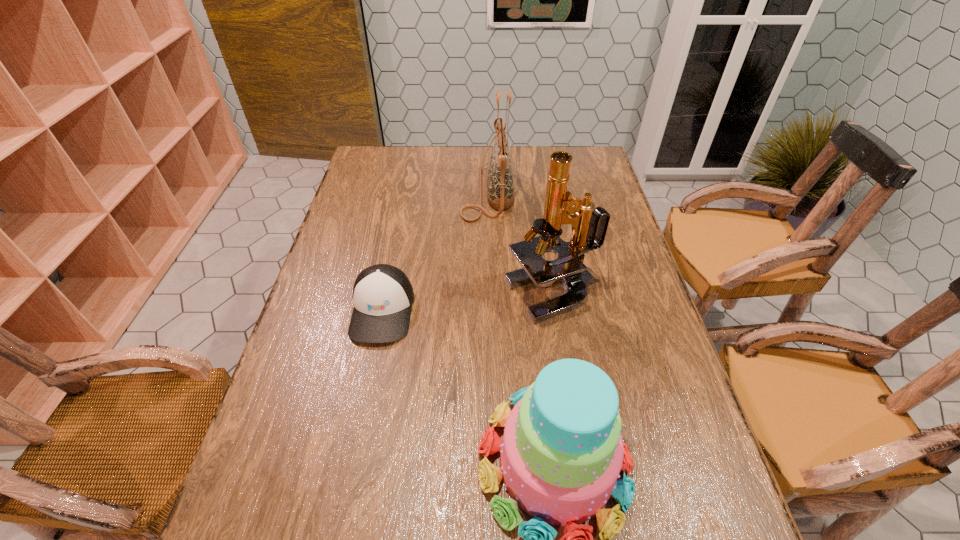
Identify the location of unoccupied area between the microscope and the leftmost object. (468, 302).

Identify the location of free space between the leftmost object and the tallest object. This screenshot has width=960, height=540. (468, 302).

Locate an element on the screen. Image resolution: width=960 pixels, height=540 pixels. empty space between the tallest object and the leftmost object is located at coordinates (468, 302).

This screenshot has height=540, width=960. Find the location of `the second closest object to the tallest object`. the second closest object to the tallest object is located at coordinates (500, 194).

Find the location of a particular element. The width and height of the screenshot is (960, 540). object that can be found as the third closest to the leftmost object is located at coordinates (500, 194).

In order to click on vacant space that satisfies the following two spatial constraints: 1. at the eyepiece of the microscope; 2. on the front panel of the cap in this screenshot , I will do `click(558, 310)`.

I want to click on free point that satisfies the following two spatial constraints: 1. on the front-facing side of the farthest object; 2. on the front panel of the shortest object, so click(x=490, y=310).

The height and width of the screenshot is (540, 960). Identify the location of vacant space that satisfies the following two spatial constraints: 1. on the front-facing side of the farthest object; 2. on the front panel of the cap. (490, 310).

Locate an element on the screen. vacant space that satisfies the following two spatial constraints: 1. on the front-facing side of the second tallest object; 2. on the front panel of the leftmost object is located at coordinates (490, 310).

You are a GUI agent. You are given a task and a screenshot of the screen. Output one action in this format:
    pyautogui.click(x=<x>, y=<y>)
    Task: Click on the free location that satisfies the following two spatial constraints: 1. on the front-facing side of the farthest object; 2. on the front panel of the leftmost object
    Image resolution: width=960 pixels, height=540 pixels.
    Given the screenshot: What is the action you would take?
    pyautogui.click(x=490, y=310)